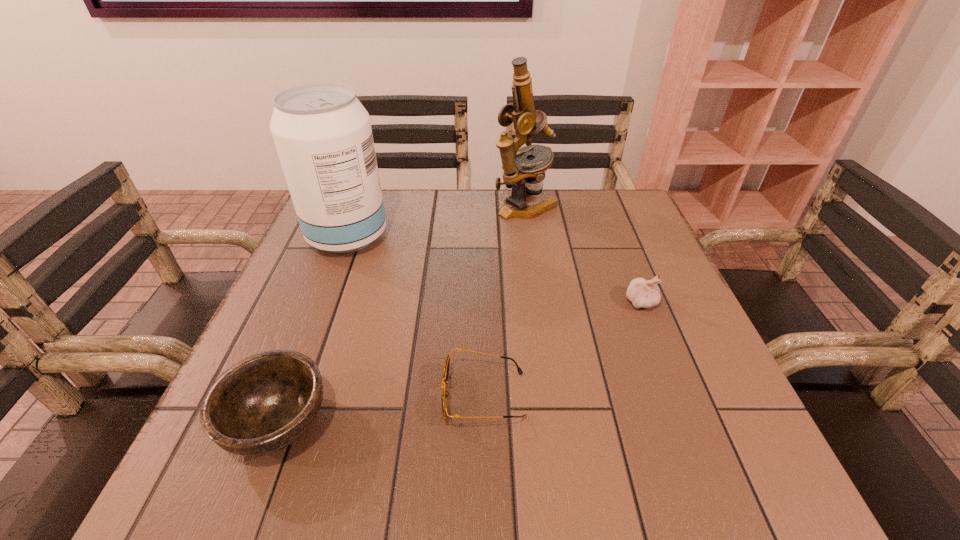
The height and width of the screenshot is (540, 960). I want to click on free space between the garlic and the bowl, so click(x=459, y=362).

This screenshot has height=540, width=960. I want to click on free space that is in between the garlic and the microscope, so click(583, 254).

The image size is (960, 540). I want to click on empty space that is in between the microscope and the shortest object, so click(x=504, y=301).

You are a GUI agent. You are given a task and a screenshot of the screen. Output one action in this format:
    pyautogui.click(x=<x>, y=<y>)
    Task: Click on the vacant space in between the garlic and the microscope
    Image resolution: width=960 pixels, height=540 pixels.
    Given the screenshot: What is the action you would take?
    pos(583,254)

This screenshot has height=540, width=960. I want to click on empty space between the microscope and the alcohol, so click(x=437, y=221).

You are a GUI agent. You are given a task and a screenshot of the screen. Output one action in this format:
    pyautogui.click(x=<x>, y=<y>)
    Task: Click on the empty location between the bowl and the microscope
    
    Given the screenshot: What is the action you would take?
    pyautogui.click(x=401, y=314)

The image size is (960, 540). What are the coordinates of `empty location between the bowl and the shortest object` in the screenshot? It's located at (380, 409).

At what (x,y) coordinates should I click in order to perform the action: click on object that stands as the fourth closest to the sunglasses. Please return your answer as a coordinate pair (x, y). The width and height of the screenshot is (960, 540). Looking at the image, I should click on (524, 176).

Identify which object is the second nearest to the rightmost object. Please provide its 2D coordinates. Your answer should be formatted as a tuple, i.e. [(x, y)], where the tuple contains the x and y coordinates of a point satisfying the conditions above.

[(524, 176)]

Identify the location of vacant space that satisfies the following two spatial constraints: 1. on the back side of the bowl; 2. on the right side of the third farthest object. This screenshot has width=960, height=540. (324, 302).